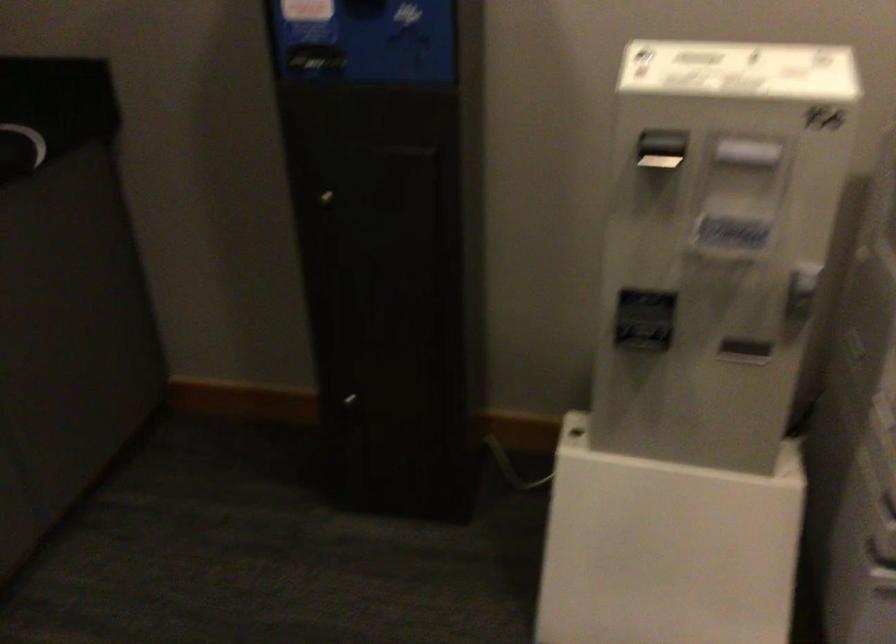
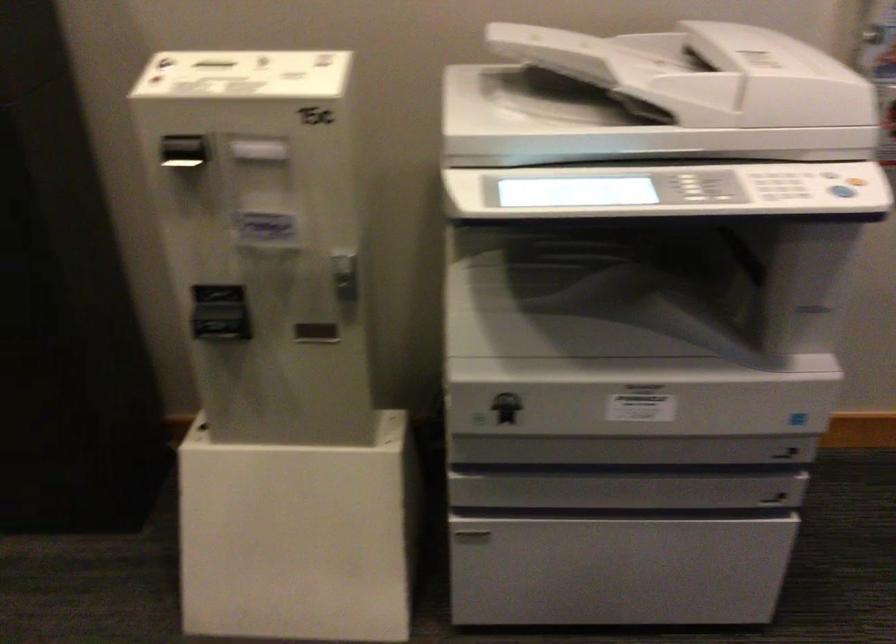
Locate, in the second image, the point that corresponds to (743,353) in the first image.

(315, 333)